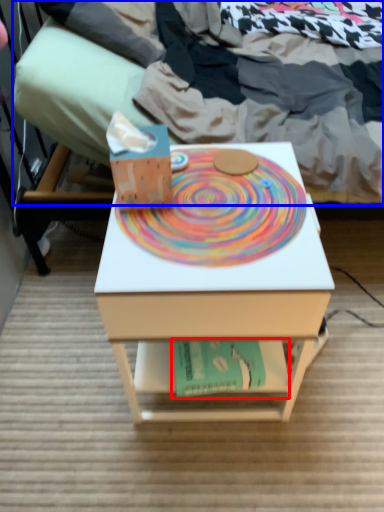
Question: Which object appears closest to the camera in this image, paperback book (highlighted by a red box) or bed (highlighted by a blue box)?

Choices:
 (A) paperback book
 (B) bed

Answer: (B)